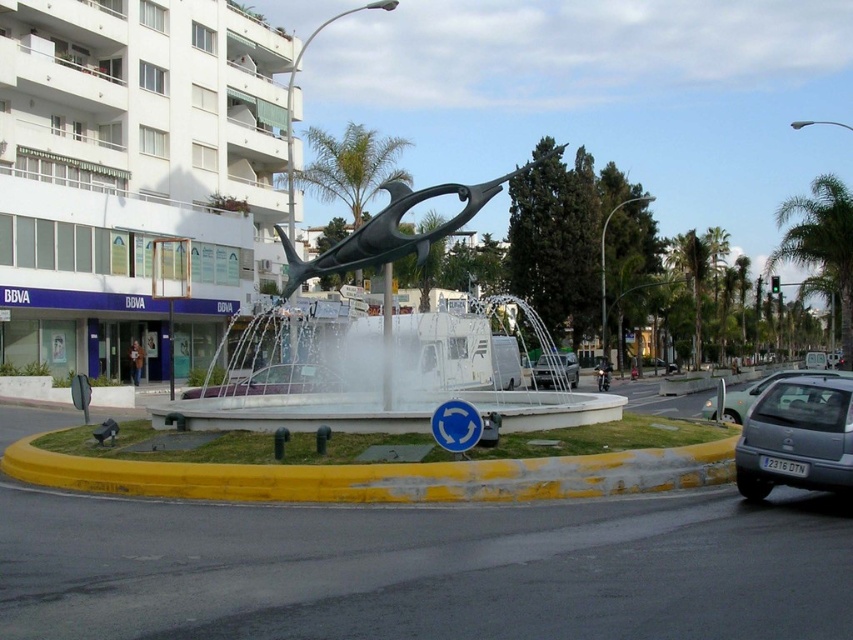
Consider the image. Measure the distance between white glossy building at upper left and camera.

white glossy building at upper left and camera are 90.87 feet apart.

Measure the distance from white glossy building at upper left to white marble fountain at center.

They are 30.42 feet apart.

Does point (149, 160) come behind point (335, 394)?

Yes, it is.

In order to click on white glossy building at upper left in this screenshot , I will do `click(132, 173)`.

Does white glossy building at upper left have a lesser height compared to yellow concrete curb at lower center?

Incorrect, white glossy building at upper left's height does not fall short of yellow concrete curb at lower center's.

Between point (25, 22) and point (569, 467), which one is positioned behind?

Positioned behind is point (25, 22).

Where is `white glossy building at upper left`? This screenshot has width=853, height=640. white glossy building at upper left is located at coordinates (132, 173).

Between white marble fountain at center and metallic gray hatchback at lower right, which one is positioned higher?

Positioned higher is white marble fountain at center.

Is white marble fountain at center bigger than metallic gray hatchback at lower right?

Correct, white marble fountain at center is larger in size than metallic gray hatchback at lower right.

The height and width of the screenshot is (640, 853). What are the coordinates of `white marble fountain at center` in the screenshot? It's located at (379, 408).